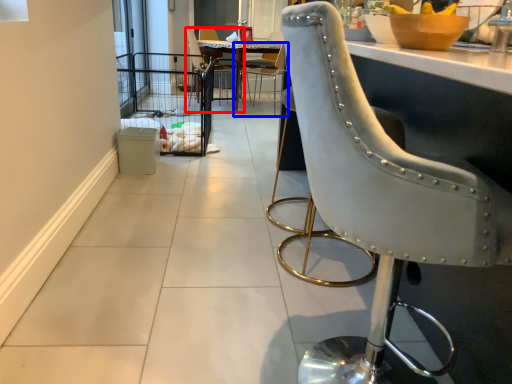
Question: Which of the following is the farthest to the observer, chair (highlighted by a red box) or chair (highlighted by a blue box)?

Choices:
 (A) chair
 (B) chair

Answer: (A)